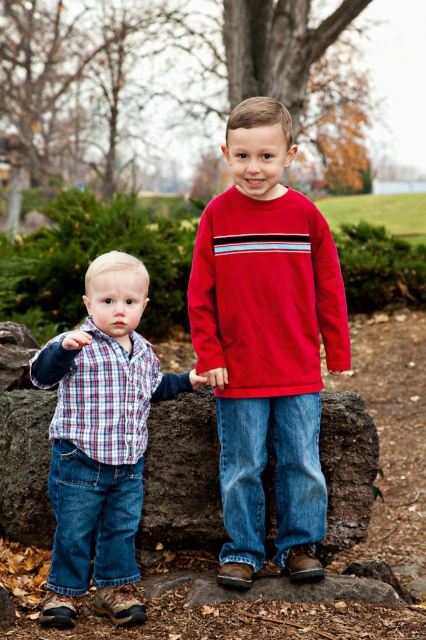
Does plaid shirt at left have a smaller size compared to red fleece sweatshirt at center?

No, plaid shirt at left is not smaller than red fleece sweatshirt at center.

How distant is plaid shirt at left from red fleece sweatshirt at center?

The distance of plaid shirt at left from red fleece sweatshirt at center is 19.57 inches.

Locate an element on the screen. plaid shirt at left is located at coordinates (100, 440).

Can you confirm if matte red long-sleeve shirt at center is shorter than red fleece sweatshirt at center?

No, matte red long-sleeve shirt at center is not shorter than red fleece sweatshirt at center.

Which is below, matte red long-sleeve shirt at center or red fleece sweatshirt at center?

matte red long-sleeve shirt at center is lower down.

Is point (299, 401) closer to camera compared to point (207, 257)?

That is True.

You are a GUI agent. You are given a task and a screenshot of the screen. Output one action in this format:
    pyautogui.click(x=<x>, y=<y>)
    Task: Click on the matte red long-sleeve shirt at center
    Image resolution: width=426 pixels, height=640 pixels.
    Given the screenshot: What is the action you would take?
    pyautogui.click(x=267, y=340)

Who is positioned more to the right, matte red long-sleeve shirt at center or plaid shirt at left?

Positioned to the right is matte red long-sleeve shirt at center.

Which of these two, matte red long-sleeve shirt at center or plaid shirt at left, stands taller?

With more height is matte red long-sleeve shirt at center.

What do you see at coordinates (267, 340) in the screenshot? I see `matte red long-sleeve shirt at center` at bounding box center [267, 340].

What are the coordinates of `matte red long-sleeve shirt at center` in the screenshot? It's located at (267, 340).